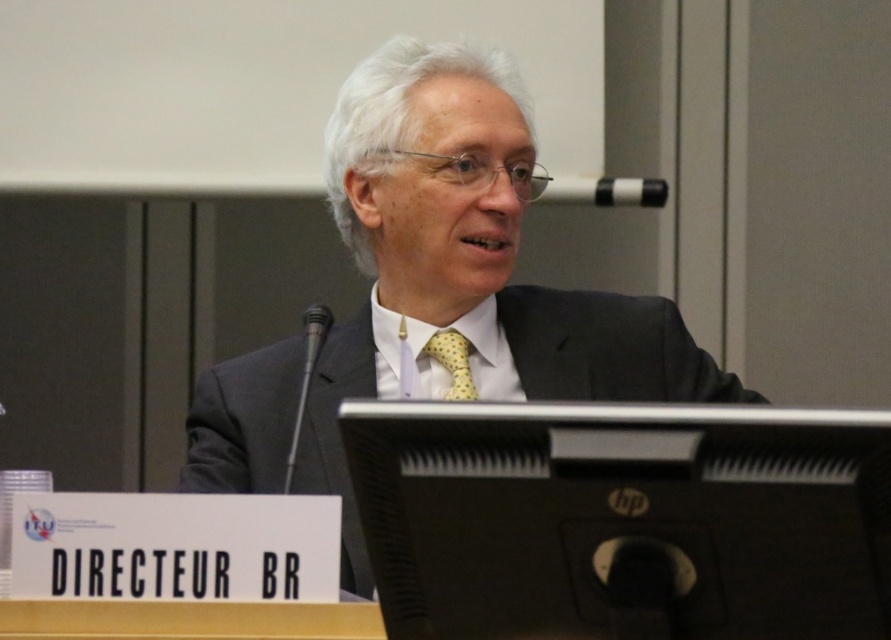
You are a sound technician at an international conference. You need to adjust the distance between the matte black suit at center and the black plastic microphone at upper center to ensure optimal audio quality. The recommended distance for clear speech is between 15 and 30 centimeters. Is the current distance within the recommended range?

The matte black suit at center and the black plastic microphone at upper center are currently 93.42 centimeters apart, which is significantly beyond the recommended 15 to 30 centimeter range for optimal audio quality. The microphone should be moved closer to the speaker wearing the matte black suit at center to ensure clear speech.

You are a sound technician in a conference room. You need to adjust the microphone for the man in the scene. The microphone is at point (607, 192). Where exactly is the microphone located relative to the man?

The point (607, 192) corresponds to the black plastic microphone at upper center, so the microphone is positioned at the upper center relative to the man.

You are a photographer trying to capture a clear shot of the matte black suit at center and the black plastic microphone at upper center. Which object should you focus on first to ensure both are in sharp focus?

The matte black suit at center is closer to the viewer than the black plastic microphone at upper center. To ensure both are in sharp focus, you should focus on the matte black suit at center first, as it is closer, and the microphone will fall into the depth of field if the focus is set correctly.